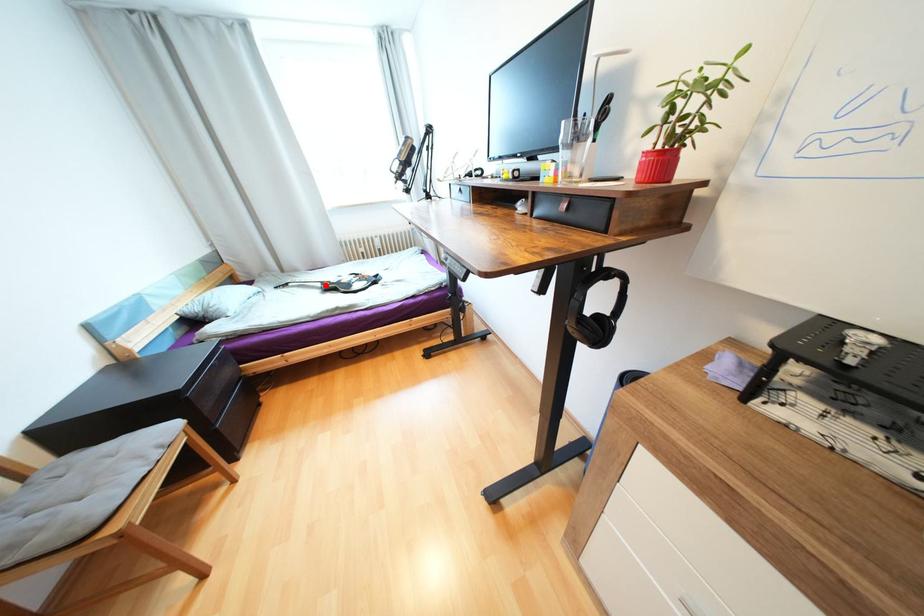
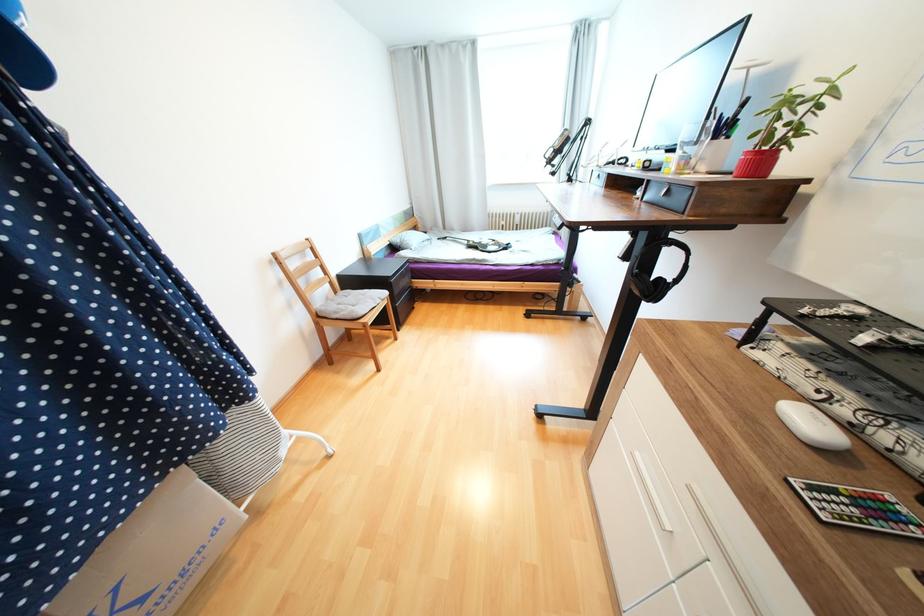
The point at the highlighted location is marked in the first image. Where is the corresponding point in the second image?

(471, 243)